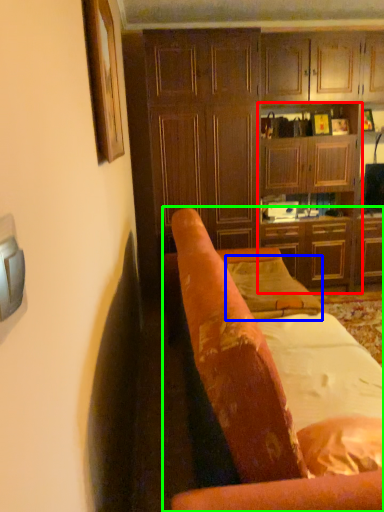
Question: Based on their relative distances, which object is nearer to tv cabinet (highlighted by a red box)? Choose from pillow (highlighted by a blue box) and chair (highlighted by a green box).

Choices:
 (A) pillow
 (B) chair

Answer: (A)